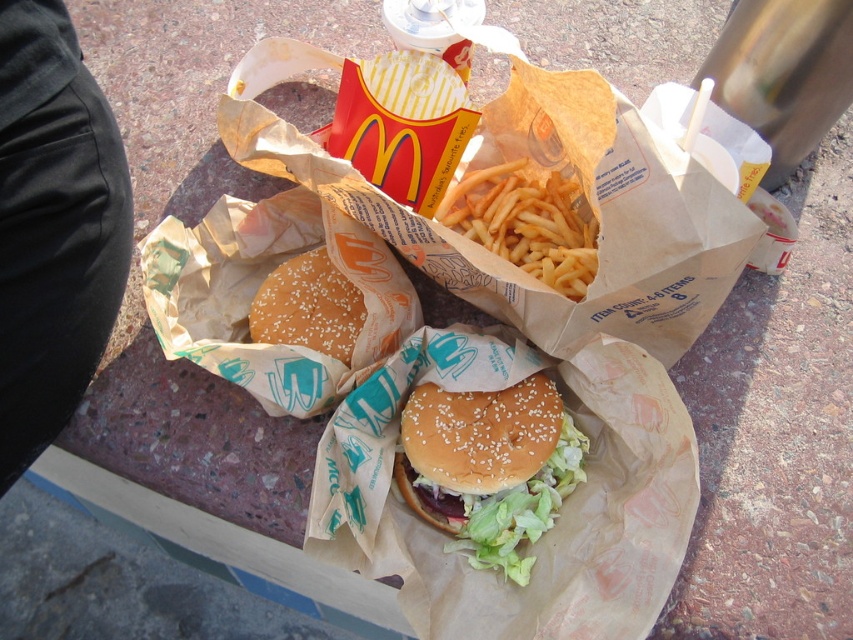
You are a delivery person who needs to deliver a McDonalds meal. The semi glossy sesame seed bun at center is part of the meal. Where exactly is the point (490, 467) located on the meal?

The point (490, 467) is located on the semi glossy sesame seed bun at center.